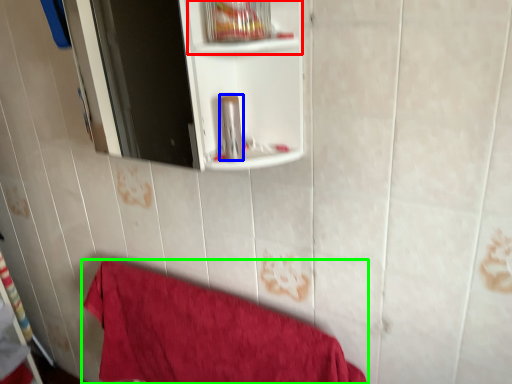
Question: Which object is the closest to the cabinet (highlighted by a red box)? Choose among these: toiletry (highlighted by a blue box) or towel (highlighted by a green box).

Choices:
 (A) toiletry
 (B) towel

Answer: (A)